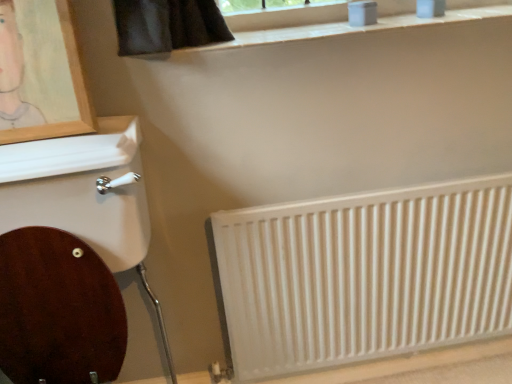
What do you see at coordinates (364, 275) in the screenshot?
I see `white textured radiator at lower right` at bounding box center [364, 275].

I want to click on white textured radiator at lower right, so click(364, 275).

The height and width of the screenshot is (384, 512). Describe the element at coordinates (74, 91) in the screenshot. I see `wooden picture frame at upper left` at that location.

Where is `wooden picture frame at upper left`? wooden picture frame at upper left is located at coordinates (74, 91).

Where is `white textured radiator at lower right`? white textured radiator at lower right is located at coordinates (364, 275).

Is wooden picture frame at upper left to the left or to the right of white textured radiator at lower right in the image?

Based on their positions, wooden picture frame at upper left is located to the left of white textured radiator at lower right.

In the image, is wooden picture frame at upper left positioned in front of or behind white textured radiator at lower right?

wooden picture frame at upper left is in front of white textured radiator at lower right.

Is point (70, 47) positioned before point (380, 323)?

Yes.

Looking at this image, from the image's perspective, is wooden picture frame at upper left positioned above or below white textured radiator at lower right?

wooden picture frame at upper left is above white textured radiator at lower right.

From a real-world perspective, which object rests below the other?

white textured radiator at lower right.

Which of these two, wooden picture frame at upper left or white textured radiator at lower right, is wider?

wooden picture frame at upper left is wider.

Is wooden picture frame at upper left taller than white textured radiator at lower right?

No, wooden picture frame at upper left is not taller than white textured radiator at lower right.

Who is smaller, wooden picture frame at upper left or white textured radiator at lower right?

With smaller size is wooden picture frame at upper left.

Do you think wooden picture frame at upper left is within white textured radiator at lower right, or outside of it?

wooden picture frame at upper left exists outside the volume of white textured radiator at lower right.

Would you say wooden picture frame at upper left is a long distance from white textured radiator at lower right?

They are positioned close to each other.

Is white textured radiator at lower right at the back of wooden picture frame at upper left?

No, wooden picture frame at upper left is not facing away from white textured radiator at lower right.

Measure the distance from wooden picture frame at upper left to white textured radiator at lower right.

The distance of wooden picture frame at upper left from white textured radiator at lower right is 83.49 centimeters.

Where is `picture frame that appears in front of the white textured radiator at lower right`? picture frame that appears in front of the white textured radiator at lower right is located at coordinates (74, 91).

Is white textured radiator at lower right at the right side of wooden picture frame at upper left?

Yes, white textured radiator at lower right is to the right of wooden picture frame at upper left.

Which is in front, white textured radiator at lower right or wooden picture frame at upper left?

wooden picture frame at upper left is more forward.

Is point (445, 211) positioned behind point (86, 123)?

Yes.

From the image's perspective, which is below, white textured radiator at lower right or wooden picture frame at upper left?

Result: white textured radiator at lower right, from the image's perspective.

From a real-world perspective, is white textured radiator at lower right physically above wooden picture frame at upper left?

No, from a real-world perspective, white textured radiator at lower right is not above wooden picture frame at upper left.

Between white textured radiator at lower right and wooden picture frame at upper left, which one has smaller width?

white textured radiator at lower right.

Which of these two, white textured radiator at lower right or wooden picture frame at upper left, stands shorter?

With less height is wooden picture frame at upper left.

Considering the sizes of objects white textured radiator at lower right and wooden picture frame at upper left in the image provided, who is bigger, white textured radiator at lower right or wooden picture frame at upper left?

Bigger between the two is white textured radiator at lower right.

Is white textured radiator at lower right surrounding wooden picture frame at upper left?

No, wooden picture frame at upper left is not surrounded by white textured radiator at lower right.

Is the surface of white textured radiator at lower right in direct contact with wooden picture frame at upper left?

No, white textured radiator at lower right is not making contact with wooden picture frame at upper left.

Is white textured radiator at lower right facing towards wooden picture frame at upper left?

No, white textured radiator at lower right does not turn towards wooden picture frame at upper left.

How different are the orientations of white textured radiator at lower right and wooden picture frame at upper left in degrees?

0.483 degrees separate the facing orientations of white textured radiator at lower right and wooden picture frame at upper left.

Measure the distance from white textured radiator at lower right to wooden picture frame at upper left.

white textured radiator at lower right and wooden picture frame at upper left are 83.49 centimeters apart from each other.

This screenshot has width=512, height=384. I want to click on radiator below the wooden picture frame at upper left (from the image's perspective), so click(364, 275).

In order to click on radiator behind the wooden picture frame at upper left in this screenshot , I will do `click(364, 275)`.

Find the location of a particular element. This screenshot has width=512, height=384. picture frame located on the left of white textured radiator at lower right is located at coordinates (74, 91).